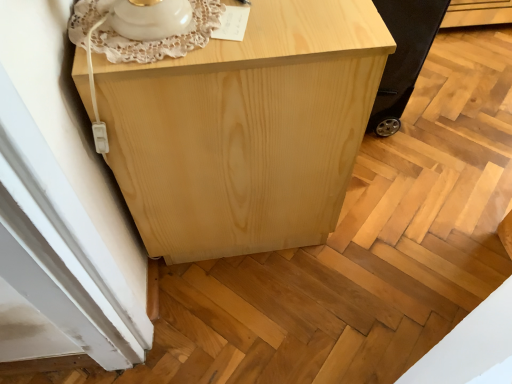
Locate an element on the screen. vacant area located to the right-hand side of natural wood cabinet at center is located at coordinates (431, 173).